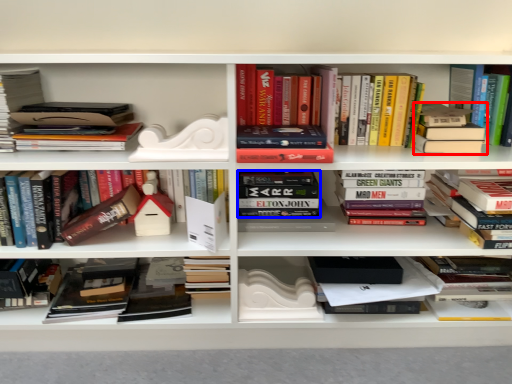
Question: Which of the following is the farthest to the observer, book (highlighted by a red box) or book (highlighted by a blue box)?

Choices:
 (A) book
 (B) book

Answer: (B)